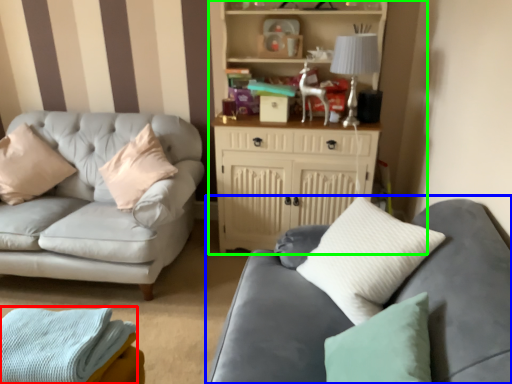
Question: Which object is positioned farthest from material (highlighted by a red box)? Select from studio couch (highlighted by a blue box) and entertainment center (highlighted by a green box).

Choices:
 (A) studio couch
 (B) entertainment center

Answer: (B)